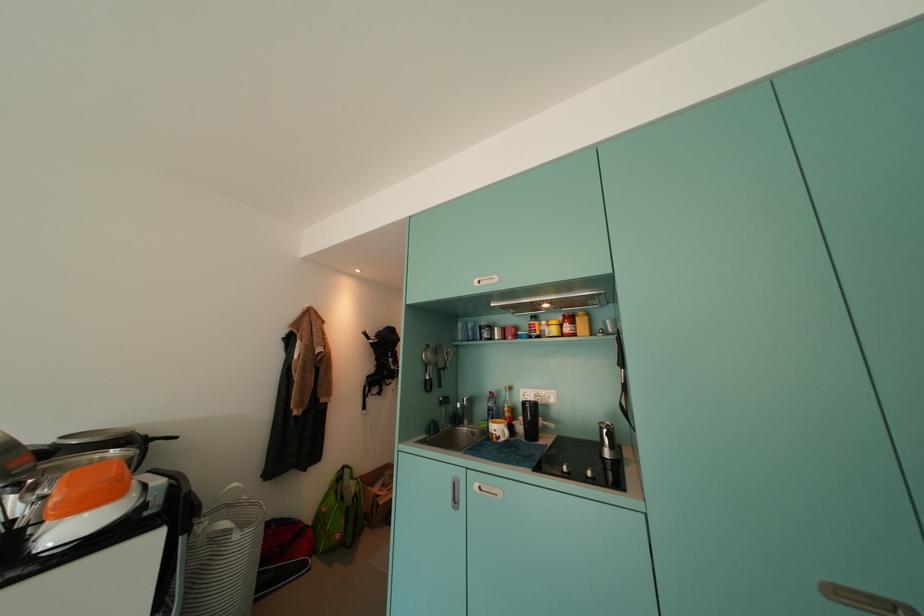
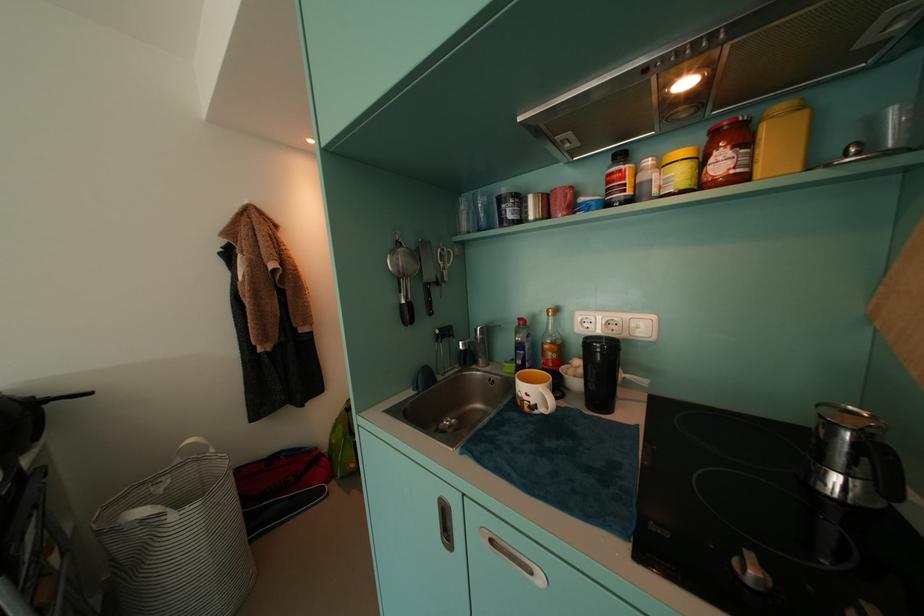
Where in the second image is the point corresponding to point 233,527 from the first image?

(149, 516)